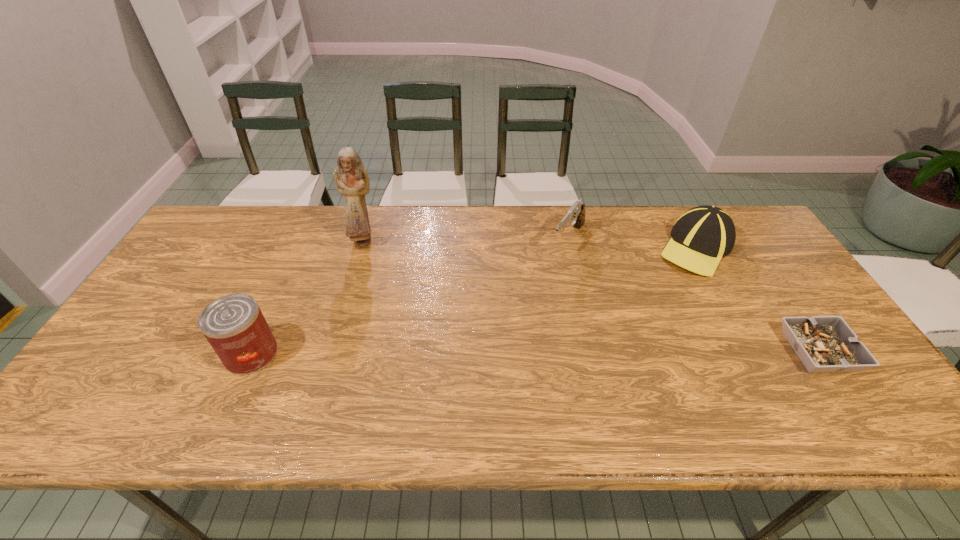
Image resolution: width=960 pixels, height=540 pixels. In order to click on free space on the desktop that is between the leftmost object and the ashtray and is positioned at the muzzle of the gun in this screenshot , I will do pos(490,353).

The width and height of the screenshot is (960, 540). I want to click on free space on the desktop that is between the leftmost object and the shortest object and is positioned on the front-facing side of the fourth object from right to left, so click(460, 353).

You are a GUI agent. You are given a task and a screenshot of the screen. Output one action in this format:
    pyautogui.click(x=<x>, y=<y>)
    Task: Click on the free space on the desktop that is between the can and the ashtray and is positioned with the brim of the baseball cap facing forward
    
    Given the screenshot: What is the action you would take?
    pyautogui.click(x=567, y=353)